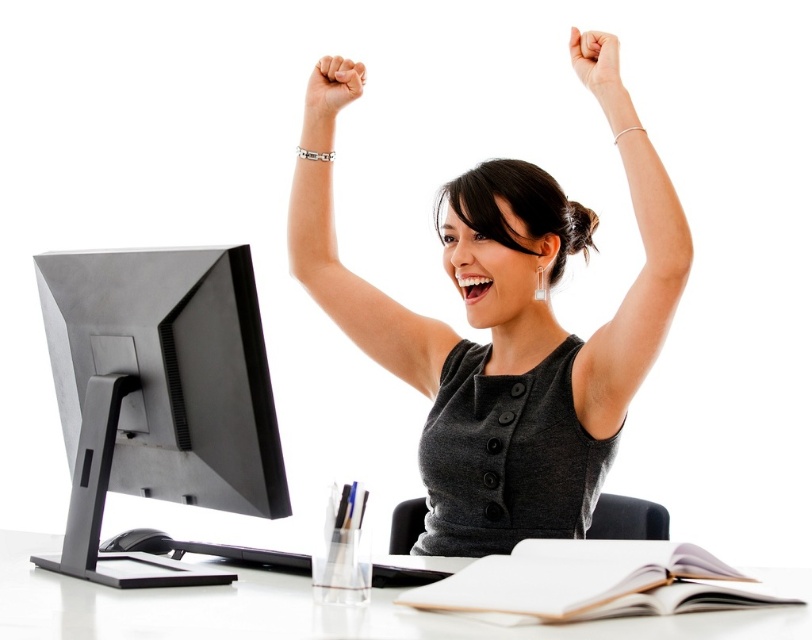
You are a fashion designer observing the woman in the image. You need to determine which item of clothing or accessory is larger in size between the gray matte dress at center and the silver metallic bracelet at upper center. Which one is larger?

The gray matte dress at center is bigger than the silver metallic bracelet at upper center, so the dress is larger in size.

You are a delivery robot trying to place a package on the desk. The package must be placed at either point (674,307) or point (609,56). Which point is closer to you?

Point (674,307) is closer to the viewer than point (609,56), so you should place the package there.

Consider the image. You are an interior designer assessing the layout of this office space. You need to ensure that the gray matte dress at center and the silver metallic bracelet at upper center are visible from the entrance. Given their sizes, which object might require a higher placement to ensure visibility?

The gray matte dress at center is taller than the silver metallic bracelet at upper center, so it might not require a higher placement. The silver metallic bracelet at upper center, being shorter, might need to be placed higher to ensure visibility from the entrance.